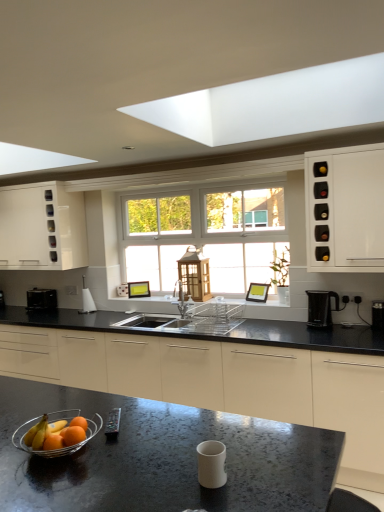
Find the location of a particular element. The image size is (384, 512). vacant space in front of white matte cup at center, the fourth appliance positioned from the left is located at coordinates (226, 497).